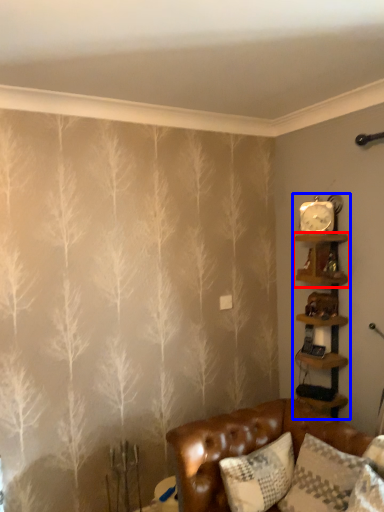
Question: Which point is closer to the camera, shelf (highlighted by a red box) or shelf (highlighted by a blue box)?

Choices:
 (A) shelf
 (B) shelf

Answer: (A)